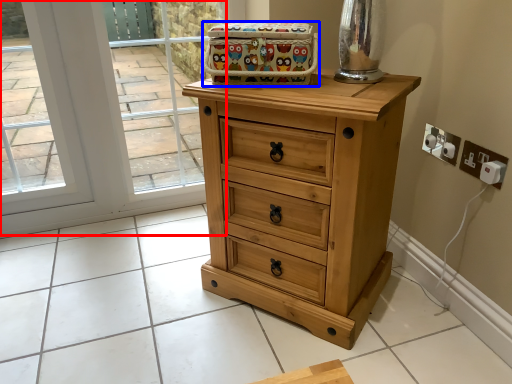
Question: Which of the following is the closest to the observer, glass door (highlighted by a red box) or crate (highlighted by a blue box)?

Choices:
 (A) glass door
 (B) crate

Answer: (B)